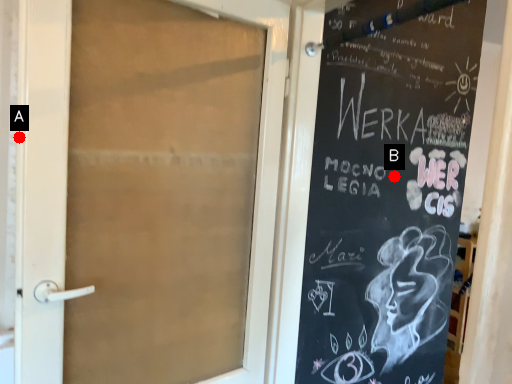
Question: Two points are circled on the image, labeled by A and B beside each circle. Among these points, which one is nearest to the camera?

Choices:
 (A) A is closer
 (B) B is closer

Answer: (A)